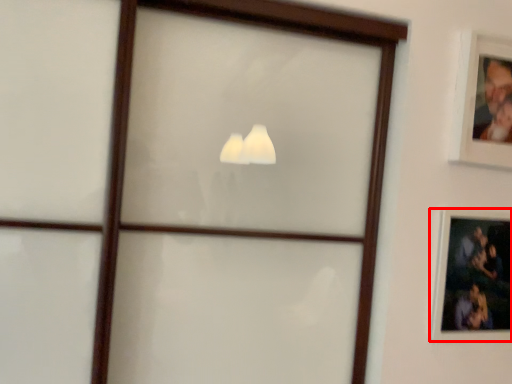
Question: From the image, what is the correct spatial relationship of picture frame (annotated by the red box) in relation to picture frame?

Choices:
 (A) left
 (B) right

Answer: (A)